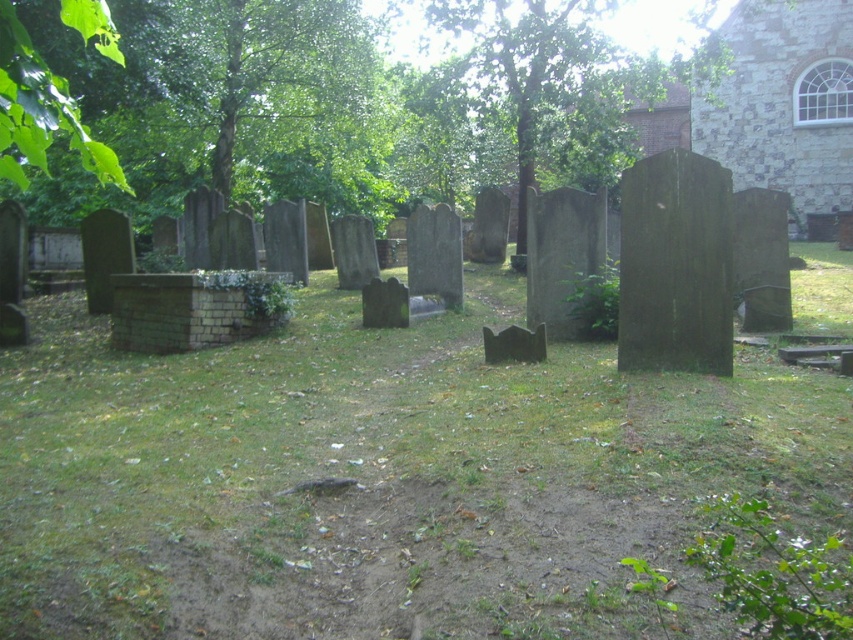
You are a gardener who needs to mow the lawn. You see the green grass at center and the green leafy tree at upper center. Which one is shorter?

The green grass at center is shorter than the green leafy tree at upper center.

You are standing at point A located at point (x=187, y=570). You want to walk to point B which is 3.73 meters away. Is there any obstacle between you and point B?

The distance between point A located at point (x=187, y=570) and point B is 3.73 meters. However, the scene includes several gravestones and a small brick structure near the center left, so there might be obstacles between them. You should check the path for any gravestones or the brick structure before proceeding.

You are a gardener planning to mow the green grass at center and the area around the brown stone church at upper right. Which area requires a wider mower path?

The green grass at center requires a wider mower path because its width is larger than that of the brown stone church at upper right.